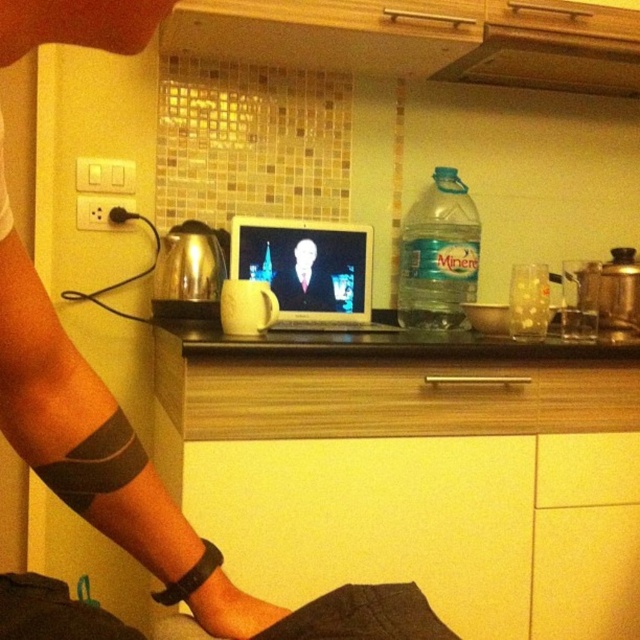
You are a delivery robot trying to place a package on the white glossy laptop at center. The package is 10cm x 10cm. Can you place it there without moving the laptop?

The white glossy laptop at center is located at point (308, 269). Since the package is 10cm x 10cm, it can be placed there as long as there is enough space on the countertop. However, the exact dimensions of the countertop aren

You are trying to reach for the translucent plastic water bottle at right while sitting in front of the wooden drawer at center. Which object is closer to you?

The wooden drawer at center is closer to you than the translucent plastic water bottle at right.

You are organizing a tech repair event and need to place two laptops on a narrow shelf. The white glossy laptop at center and the black glossy laptop at center must be arranged side by side. Given the shelf is only wide enough for one laptop, which laptop should you move to ensure both fit?

The white glossy laptop at center is positioned on the left side of the black glossy laptop at center. To fit both on the narrow shelf, you should move the white glossy laptop at center to the right side of the black glossy laptop at center, aligning them in a single row.